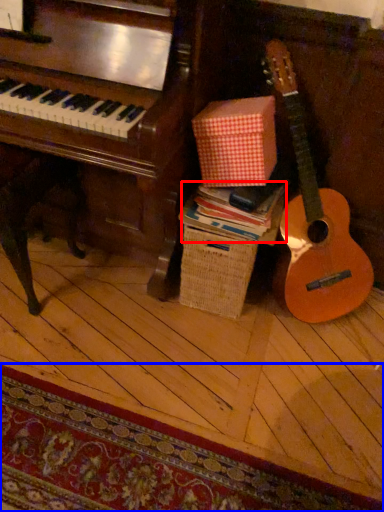
Question: Which point is closer to the camera, book (highlighted by a red box) or mat (highlighted by a blue box)?

Choices:
 (A) book
 (B) mat

Answer: (B)